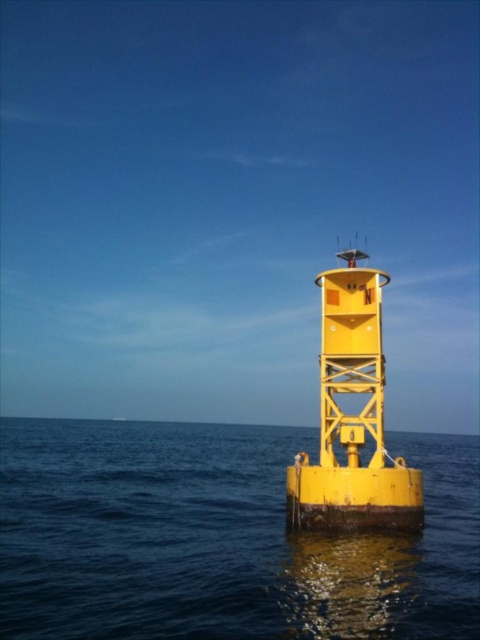
Question: From the image, what is the correct spatial relationship of smooth blue water at center in relation to metallic yellow buoy at center?

Choices:
 (A) above
 (B) below

Answer: (B)

Question: Which of the following is the farthest from the observer?

Choices:
 (A) (375, 321)
 (B) (78, 620)

Answer: (A)

Question: Is smooth blue water at center bigger than metallic yellow buoy at center?

Choices:
 (A) yes
 (B) no

Answer: (A)

Question: Does smooth blue water at center have a greater width compared to metallic yellow buoy at center?

Choices:
 (A) no
 (B) yes

Answer: (B)